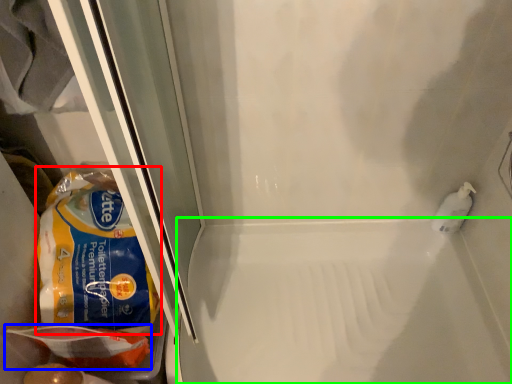
Question: Considering the real-world distances, which object is farthest from cereal (highlighted by a red box)? food (highlighted by a blue box) or bath (highlighted by a green box)?

Choices:
 (A) food
 (B) bath

Answer: (B)